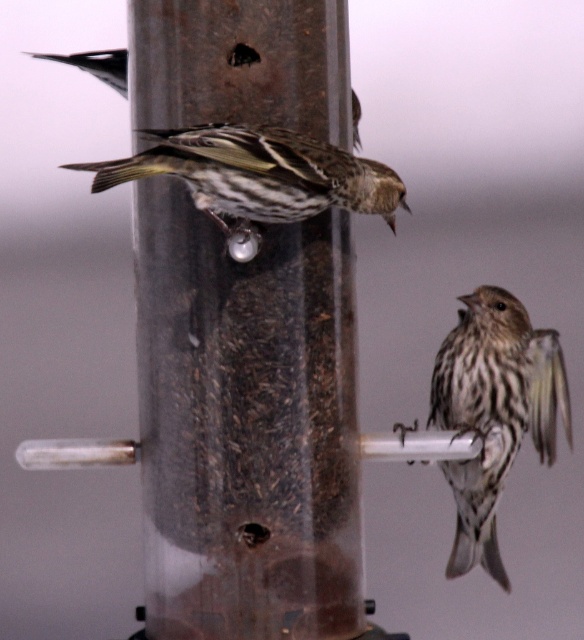
Question: Does brown speckled sparrow at right have a smaller size compared to brown striped sparrow at center?

Choices:
 (A) yes
 (B) no

Answer: (B)

Question: Which point appears farthest from the camera in this image?

Choices:
 (A) (86, 60)
 (B) (109, 182)

Answer: (A)

Question: Which of the following is the farthest from the observer?

Choices:
 (A) brown speckled sparrow at right
 (B) brown striped sparrow at center

Answer: (A)

Question: Among these points, which one is farthest from the camera?

Choices:
 (A) (53, 58)
 (B) (537, 417)

Answer: (A)

Question: Is brown speckled sparrow at right thinner than brown striped sparrow at center?

Choices:
 (A) yes
 (B) no

Answer: (A)

Question: Is brown speckled sparrow at right bigger than dark brown speckled sparrow at upper left?

Choices:
 (A) yes
 (B) no

Answer: (A)